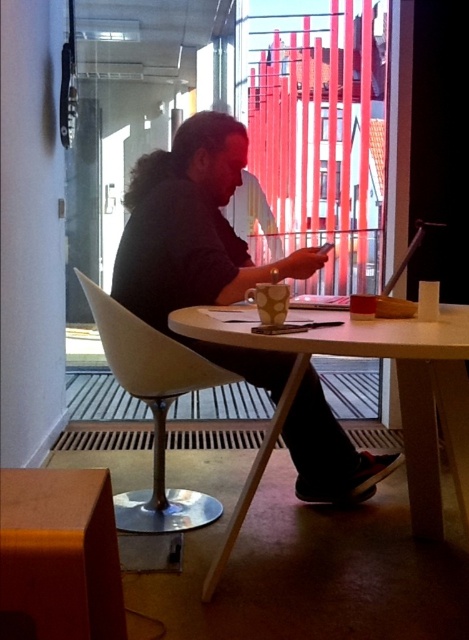
Can you confirm if dark gray hoodie at center is positioned above white wood table at center?

Correct, dark gray hoodie at center is located above white wood table at center.

Is dark gray hoodie at center shorter than white wood table at center?

No.

Is point (301, 426) farther from viewer compared to point (424, 374)?

That is True.

You are a GUI agent. You are given a task and a screenshot of the screen. Output one action in this format:
    pyautogui.click(x=<x>, y=<y>)
    Task: Click on the dark gray hoodie at center
    
    Given the screenshot: What is the action you would take?
    pyautogui.click(x=198, y=243)

Does dark gray hoodie at center have a greater height compared to matte white chair at center?

Correct, dark gray hoodie at center is much taller as matte white chair at center.

Where is `dark gray hoodie at center`? The image size is (469, 640). dark gray hoodie at center is located at coordinates (198, 243).

Where is `dark gray hoodie at center`? Image resolution: width=469 pixels, height=640 pixels. dark gray hoodie at center is located at coordinates (198, 243).

Does white wood table at center appear under matte white chair at center?

Yes.

Is white wood table at center bigger than matte white chair at center?

Indeed, white wood table at center has a larger size compared to matte white chair at center.

The image size is (469, 640). What do you see at coordinates (398, 390) in the screenshot?
I see `white wood table at center` at bounding box center [398, 390].

This screenshot has height=640, width=469. I want to click on white wood table at center, so click(398, 390).